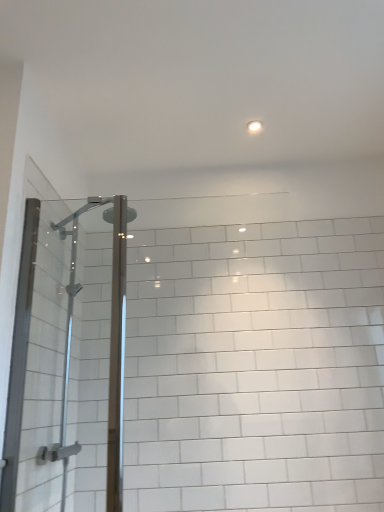
Question: Is clear glass shower door at left inside the boundaries of white glossy light fixture at upper center, or outside?

Choices:
 (A) inside
 (B) outside

Answer: (B)

Question: From the image's perspective, is clear glass shower door at left positioned above or below white glossy light fixture at upper center?

Choices:
 (A) above
 (B) below

Answer: (B)

Question: Is clear glass shower door at left in front of or behind white glossy light fixture at upper center in the image?

Choices:
 (A) front
 (B) behind

Answer: (A)

Question: Is white glossy light fixture at upper center inside the boundaries of clear glass shower door at left, or outside?

Choices:
 (A) outside
 (B) inside

Answer: (A)

Question: Is white glossy light fixture at upper center bigger or smaller than clear glass shower door at left?

Choices:
 (A) big
 (B) small

Answer: (B)

Question: Is white glossy light fixture at upper center in front of or behind clear glass shower door at left in the image?

Choices:
 (A) front
 (B) behind

Answer: (B)

Question: Considering the positions of point (253, 128) and point (91, 480), is point (253, 128) closer or farther from the camera than point (91, 480)?

Choices:
 (A) closer
 (B) farther

Answer: (B)